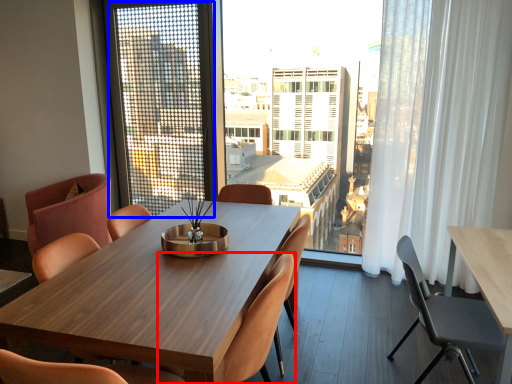
Question: Among these objects, which one is nearest to the camera, chair (highlighted by a red box) or screen door (highlighted by a blue box)?

Choices:
 (A) chair
 (B) screen door

Answer: (A)